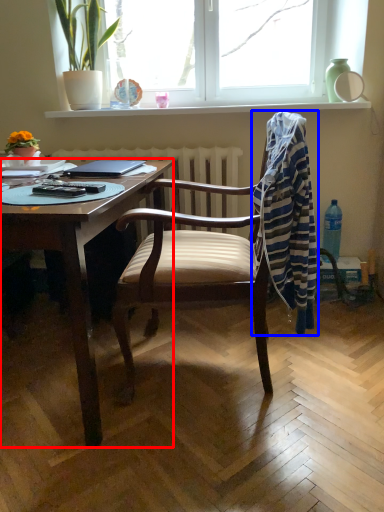
Question: Among these objects, which one is nearest to the camera, desk (highlighted by a red box) or laundry (highlighted by a blue box)?

Choices:
 (A) desk
 (B) laundry

Answer: (A)